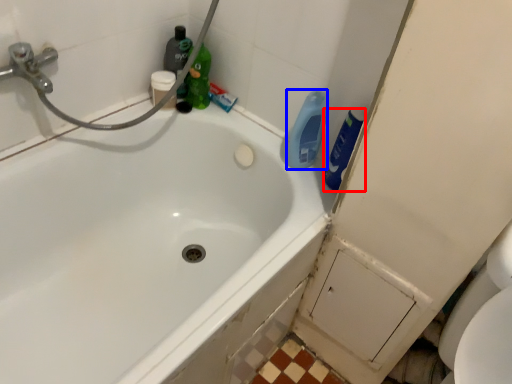
Question: Which of the following is the closest to the observer, cleaning product (highlighted by a red box) or cleaning product (highlighted by a blue box)?

Choices:
 (A) cleaning product
 (B) cleaning product

Answer: (A)